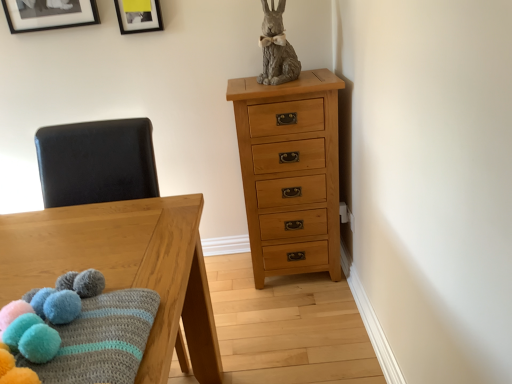
Question: Considering the positions of black matte picture frame at upper center, placed as the 1th picture frame when sorted from right to left, and black matte picture frame at upper left, placed as the second picture frame when sorted from right to left, in the image, is black matte picture frame at upper center, placed as the 1th picture frame when sorted from right to left, wider or thinner than black matte picture frame at upper left, placed as the second picture frame when sorted from right to left,?

Choices:
 (A) wide
 (B) thin

Answer: (B)

Question: From the image's perspective, is black matte picture frame at upper center, the second picture frame when ordered from left to right, above or below black matte picture frame at upper left, placed as the second picture frame when sorted from right to left?

Choices:
 (A) above
 (B) below

Answer: (B)

Question: Which object is the closest to the black matte picture frame at upper left, placed as the second picture frame when sorted from right to left?

Choices:
 (A) knitted woolen blanket with pom-poms at lower left
 (B) black leather swivel chair at left
 (C) wooden table at left
 (D) black matte picture frame at upper center, placed as the 1th picture frame when sorted from right to left
 (E) light brown wood chest of drawers at upper right

Answer: (D)

Question: Which object is positioned closest to the black matte picture frame at upper center, placed as the 1th picture frame when sorted from right to left?

Choices:
 (A) light brown wood chest of drawers at upper right
 (B) black leather swivel chair at left
 (C) black matte picture frame at upper left, acting as the first picture frame starting from the left
 (D) knitted woolen blanket with pom-poms at lower left
 (E) wooden table at left

Answer: (C)